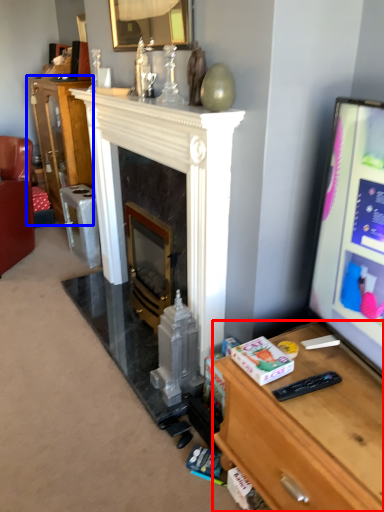
Question: Which point is closer to the camera, desk (highlighted by a red box) or cabinetry (highlighted by a blue box)?

Choices:
 (A) desk
 (B) cabinetry

Answer: (A)